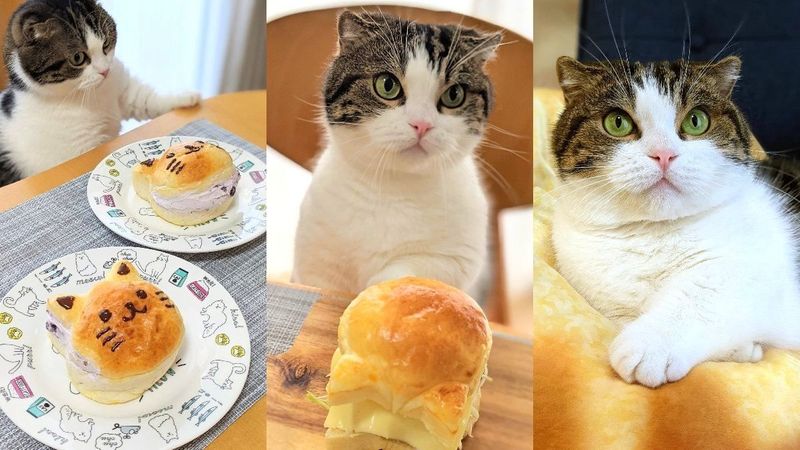
Where is `plate`? This screenshot has width=800, height=450. plate is located at coordinates (212, 402), (234, 228).